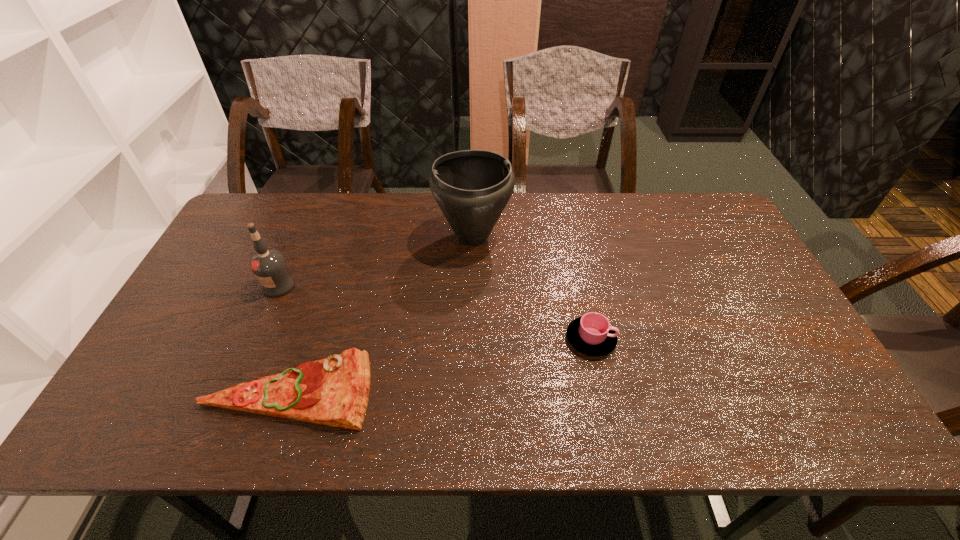
Image resolution: width=960 pixels, height=540 pixels. I want to click on free location that satisfies the following two spatial constraints: 1. on the front label of the vodka; 2. on the right side of the pizza, so click(x=234, y=389).

Identify the location of vacant position in the image that satisfies the following two spatial constraints: 1. on the back side of the pizza; 2. on the right side of the third object from left to right. The height and width of the screenshot is (540, 960). (340, 237).